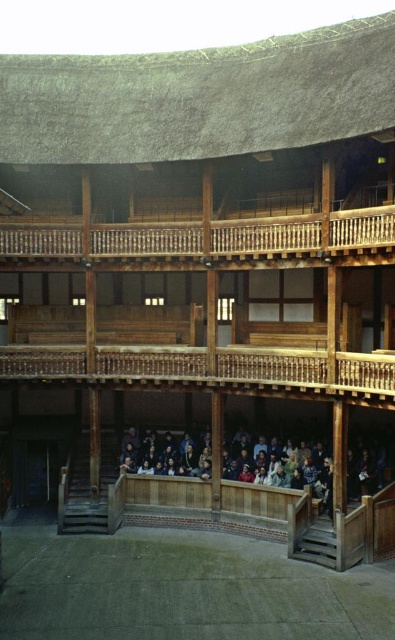
Is wooden balustrade at center taller than wooden bench at center?

Incorrect, wooden balustrade at center's height is not larger of wooden bench at center's.

The height and width of the screenshot is (640, 395). In order to click on wooden balustrade at center in this screenshot , I will do `click(212, 369)`.

Is point (107, 380) positioned before point (242, 448)?

Yes, point (107, 380) is in front of point (242, 448).

Find the location of `wooden balustrade at center`. wooden balustrade at center is located at coordinates (212, 369).

Is point (263, 600) positioned behind point (329, 506)?

No, it is not.

This screenshot has height=640, width=395. I want to click on smooth concrete stage at center, so pyautogui.click(x=182, y=589).

Between point (15, 540) and point (351, 397), which one is positioned in front?

Point (351, 397) is more forward.

Is point (231, 554) farther from camera compared to point (218, 388)?

That is False.

Describe the element at coordinates (182, 589) in the screenshot. The width and height of the screenshot is (395, 640). I see `smooth concrete stage at center` at that location.

Locate an element on the screen. This screenshot has width=395, height=640. smooth concrete stage at center is located at coordinates (182, 589).